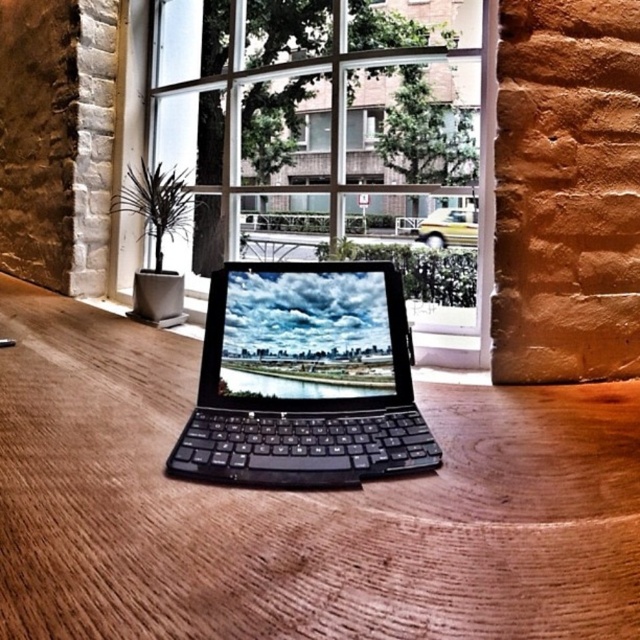
You are sitting at the wooden table at center and want to look outside through the transparent glass window at center. Which direction should you turn your head to face the window?

The wooden table at center is positioned on the left side of transparent glass window at center, so you should turn your head to the right to face the window.

You are standing in the room and want to place a 16 inches wide book on the wooden table at center. Can the book fit on the table?

The wooden table at center is 15.70 inches from camera. Since the distance is less than the book width, the book might not fit. Check the table dimensions.

You are a delivery person who needs to deliver a package to the wooden table at center. The yellow matte car at center is blocking the path. Can you walk around the car to reach the table?

The wooden table at center is in front of the yellow matte car at center, so the car is between you and the table. You would need to go around the car to reach the table.